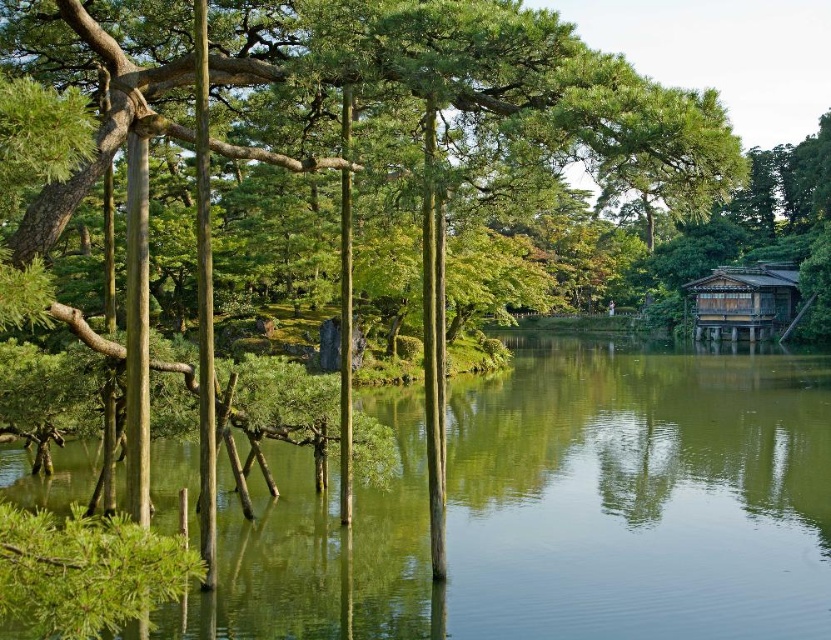
You are standing at the edge of the green reflective water at center in a traditional Japanese garden. You notice a point marked at coordinates (559,509). Based on the scene description, can you determine if this point is located on the water or on the surrounding land?

The point (559,509) is on the green reflective water at center, so it is located on the water.